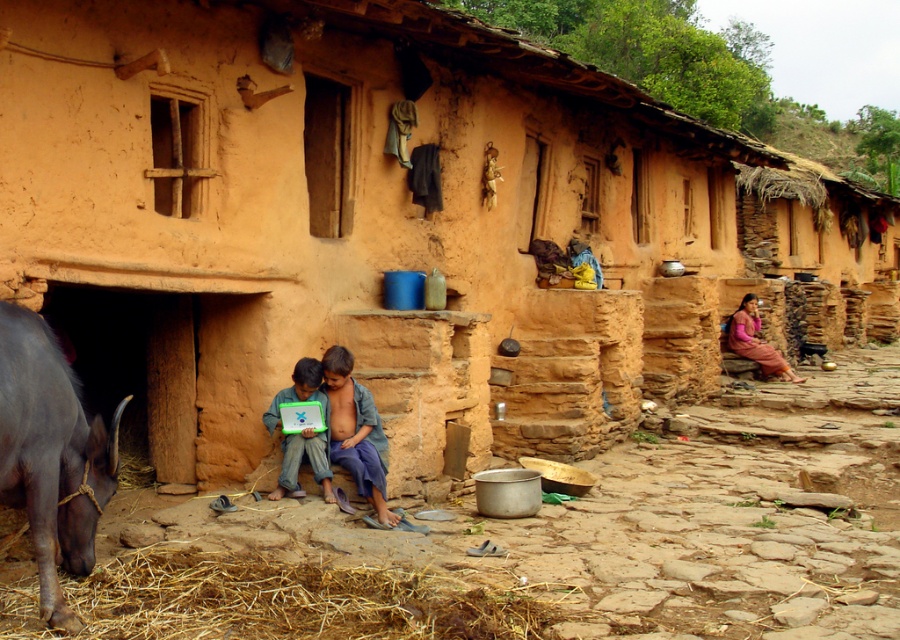
From the picture: Is the position of dark gray fur at lower left less distant than that of pink fabric skirt at right?

Yes, it is in front of pink fabric skirt at right.

Between point (51, 579) and point (754, 324), which one is positioned behind?

The point (754, 324) is behind.

Who is more forward, (6, 371) or (747, 326)?

Point (6, 371) is in front.

Identify the location of dark gray fur at lower left. The width and height of the screenshot is (900, 640). (51, 454).

Does dark gray fur at lower left have a smaller size compared to matte green laptop at lower center?

Actually, dark gray fur at lower left might be larger than matte green laptop at lower center.

Between dark gray fur at lower left and matte green laptop at lower center, which one appears on the left side from the viewer's perspective?

Positioned to the left is dark gray fur at lower left.

This screenshot has width=900, height=640. In order to click on dark gray fur at lower left in this screenshot , I will do `click(51, 454)`.

Is brown straw at lower left closer to the viewer compared to dark gray fur at lower left?

No, brown straw at lower left is behind dark gray fur at lower left.

From the picture: Can you confirm if brown straw at lower left is positioned to the left of dark gray fur at lower left?

No, brown straw at lower left is not to the left of dark gray fur at lower left.

Does point (166, 580) lie in front of point (50, 342)?

No, (166, 580) is further to viewer.

At what (x,y) coordinates should I click in order to perform the action: click on brown straw at lower left. Please return your answer as a coordinate pair (x, y). Looking at the image, I should click on (291, 600).